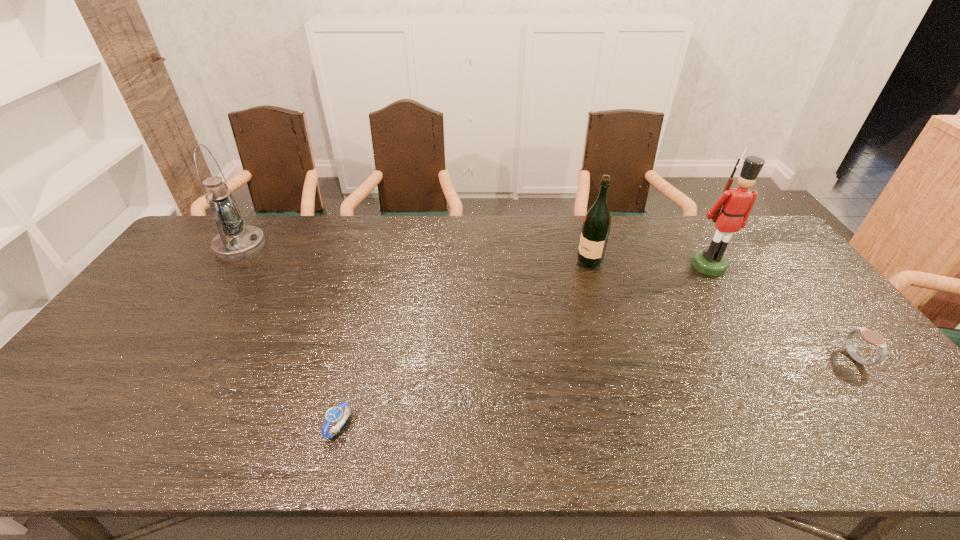
You are a GUI agent. You are given a task and a screenshot of the screen. Output one action in this format:
    pyautogui.click(x=<x>, y=<y>)
    Task: Click on the free space between the third object from right to left and the leftmost object
    Image resolution: width=960 pixels, height=540 pixels.
    Given the screenshot: What is the action you would take?
    coord(415,254)

You are a GUI agent. You are given a task and a screenshot of the screen. Output one action in this format:
    pyautogui.click(x=<x>, y=<y>)
    Task: Click on the empty space between the rightmost object and the third shortest object
    The width and height of the screenshot is (960, 540).
    Given the screenshot: What is the action you would take?
    pyautogui.click(x=723, y=310)

Find the location of a particular element. This screenshot has width=960, height=540. free spot between the liquor and the fourth object from left to right is located at coordinates (649, 264).

The height and width of the screenshot is (540, 960). Identify the location of blank region between the farther watch and the nutcracker. (782, 312).

The image size is (960, 540). In order to click on free spot between the farther watch and the nutcracker in this screenshot , I will do `click(782, 312)`.

The height and width of the screenshot is (540, 960). I want to click on empty space between the nutcracker and the right watch, so click(782, 312).

The height and width of the screenshot is (540, 960). I want to click on free area in between the fourth object from left to right and the shorter watch, so click(x=524, y=346).

Where is `object that stands as the third closest to the nutcracker`? The width and height of the screenshot is (960, 540). object that stands as the third closest to the nutcracker is located at coordinates (335, 414).

Identify which object is located as the third nearest to the shortest object. Please provide its 2D coordinates. Your answer should be formatted as a tuple, i.e. [(x, y)], where the tuple contains the x and y coordinates of a point satisfying the conditions above.

[(738, 202)]

I want to click on blank area in the image that satisfies the following two spatial constraints: 1. on the back side of the fourth tallest object; 2. on the right side of the nearer watch, so click(x=357, y=359).